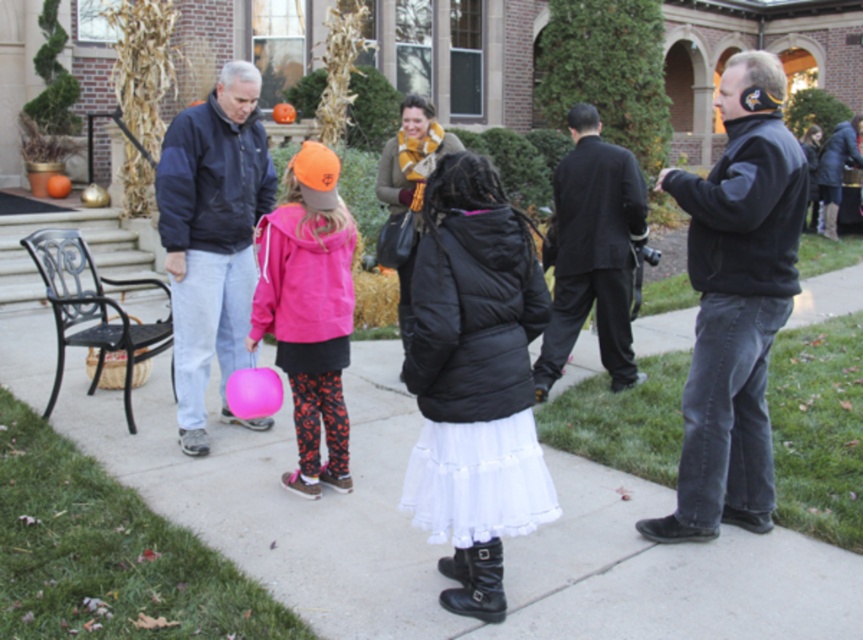
You are a delivery person trying to park your 2.5 meter wide delivery van on the white matte pavement at center. The dark blue jacket at left is blocking part of the pavement. Can you park your van there?

The white matte pavement at center is smaller than the dark blue jacket at left, so the pavement is not wide enough to accommodate the van. Please look for another parking spot.

In the scene shown: You are planning to place a small decorative pumpkin on the white matte pavement at center. According to the scene description, where exactly should you position it?

The white matte pavement at center should be positioned at coordinates point (448, 545) as described in the Objects Description.

You are standing at the center of the paved area and want to locate the dark blue jacket at left. Which direction should you look to find it?

You should look to the left to find the dark blue jacket at left since it is located at point (211, 234), which is on the left side of the image.